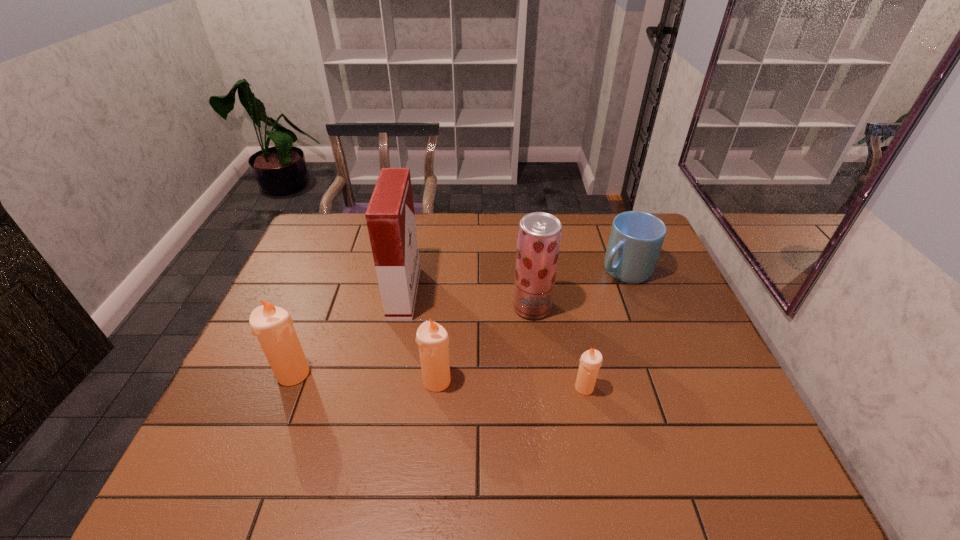
Locate an element on the screen. The height and width of the screenshot is (540, 960). the leftmost object is located at coordinates (273, 326).

The height and width of the screenshot is (540, 960). I want to click on the second candle from left to right, so pos(433,340).

At what (x,y) coordinates should I click in order to perform the action: click on the second tallest candle. Please return your answer as a coordinate pair (x, y). Looking at the image, I should click on (433, 340).

The image size is (960, 540). I want to click on the fifth object from left to right, so click(591, 360).

Locate an element on the screen. the shortest object is located at coordinates (591, 360).

Where is `the tallest object`? This screenshot has width=960, height=540. the tallest object is located at coordinates (390, 217).

At what (x,y) coordinates should I click in order to perform the action: click on the fifth object from right to left. Please return your answer as a coordinate pair (x, y). The height and width of the screenshot is (540, 960). Looking at the image, I should click on [x=390, y=217].

Where is `fruit juice`? This screenshot has width=960, height=540. fruit juice is located at coordinates [x=539, y=234].

I want to click on mug, so click(636, 238).

Where is `blank area located 0.400m on the right of the leftmost candle`? blank area located 0.400m on the right of the leftmost candle is located at coordinates (468, 374).